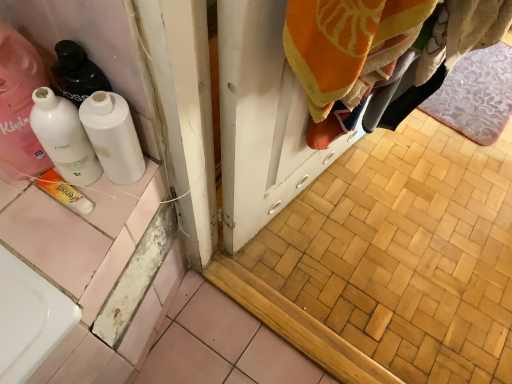
Question: In terms of width, does pink floral bath mat at lower right look wider or thinner when compared to white glossy bottle at left?

Choices:
 (A) thin
 (B) wide

Answer: (B)

Question: From the image's perspective, is pink floral bath mat at lower right above or below white glossy bottle at left?

Choices:
 (A) above
 (B) below

Answer: (A)

Question: Estimate the real-world distances between objects in this image. Which object is farther from the white glossy bottle at left, placed as the 2th bottle when sorted from left to right?

Choices:
 (A) pink floral bath mat at lower right
 (B) white glossy bottle at left, the first bottle positioned from the left
 (C) white glossy bottle at left
 (D) yellow matte tube at lower left

Answer: (A)

Question: Which of these objects is positioned closest to the pink floral bath mat at lower right?

Choices:
 (A) yellow matte tube at lower left
 (B) white glossy bottle at left
 (C) white glossy bottle at left, the first bottle positioned from the left
 (D) white glossy bottle at left, placed as the 2th bottle when sorted from left to right

Answer: (D)